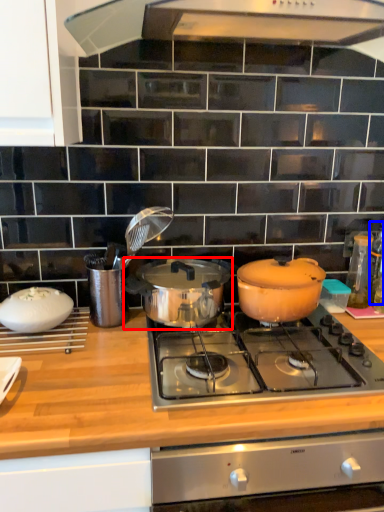
Question: Which object appears closest to the camera in this image, pot/pan (highlighted by a red box) or bottle (highlighted by a blue box)?

Choices:
 (A) pot/pan
 (B) bottle

Answer: (A)